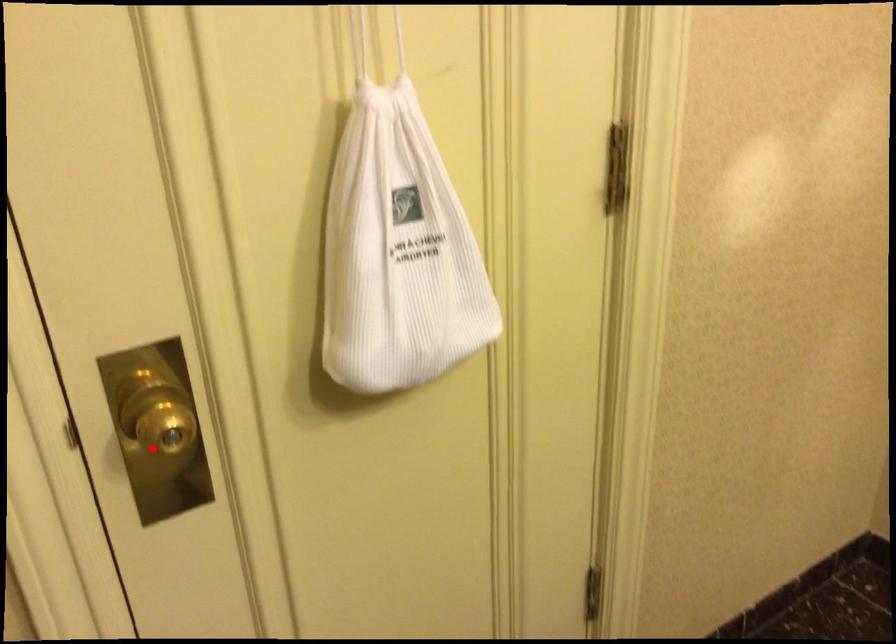
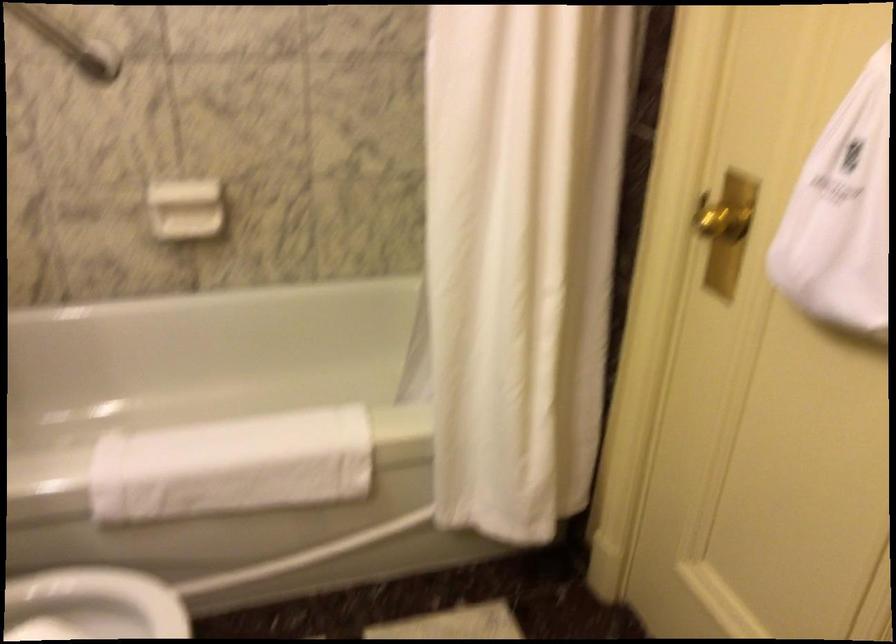
Question: A red point is marked in image1. In image2, is the corresponding 3D point closer to the camera or farther? Reply with the corresponding letter.

Choices:
 (A) The corresponding 3D point is closer.
 (B) The corresponding 3D point is farther.

Answer: (B)